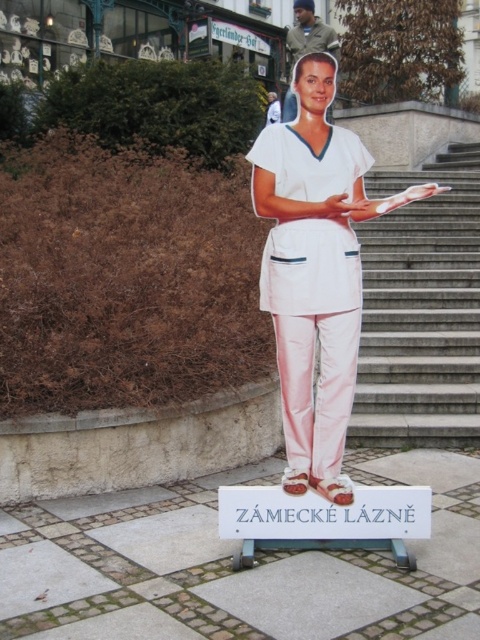
Between point (387, 264) and point (309, 324), which one is positioned in front?

Point (309, 324)

Does point (444, 328) come closer to viewer compared to point (309, 337)?

No, it is not.

Does point (408, 381) come behind point (278, 308)?

Yes, point (408, 381) is farther from viewer.

The height and width of the screenshot is (640, 480). Identify the location of smooth concrete stairs at center. (420, 310).